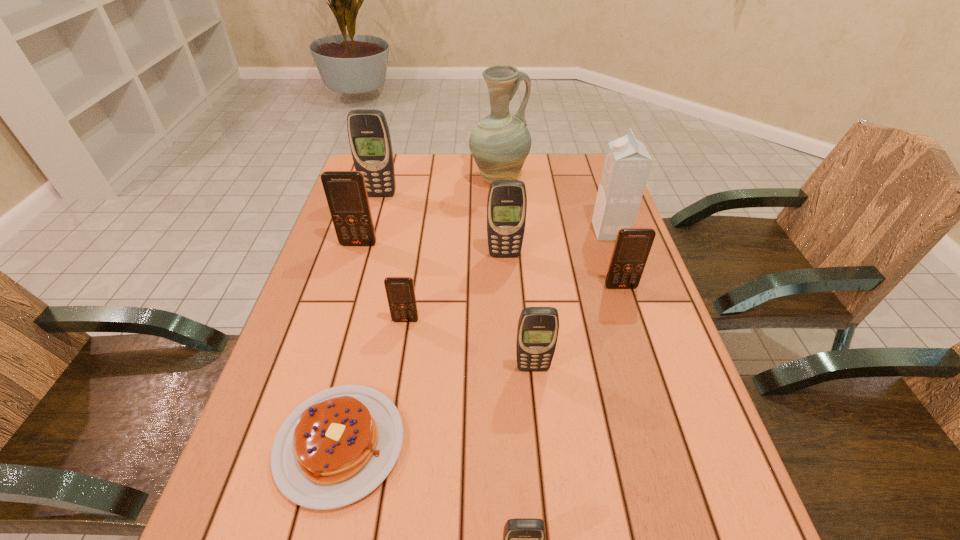
Find the location of a particular element. the second smallest orange cellular telephone is located at coordinates (632, 246).

The height and width of the screenshot is (540, 960). I want to click on the fifth nearest object, so click(632, 246).

Image resolution: width=960 pixels, height=540 pixels. Identify the location of the smallest orange cellular telephone. (400, 291).

Locate an element on the screen. The height and width of the screenshot is (540, 960). the fourth nearest object is located at coordinates (400, 291).

Where is `the second nearest object`? the second nearest object is located at coordinates (337, 446).

Locate an element on the screen. Image resolution: width=960 pixels, height=540 pixels. pancake is located at coordinates (337, 446).

I want to click on blank space located on the handle side of the pitcher, so click(x=602, y=179).

Locate an element on the screen. vacant space located 0.330m on the front label of the carton is located at coordinates (477, 231).

Image resolution: width=960 pixels, height=540 pixels. What are the coordinates of `free space located on the front label of the carton` in the screenshot? It's located at (577, 231).

At what (x,y) coordinates should I click in order to perform the action: click on vacant region located 0.100m on the front label of the carton. Please return your answer as a coordinate pair (x, y). This screenshot has width=960, height=540. Looking at the image, I should click on (559, 231).